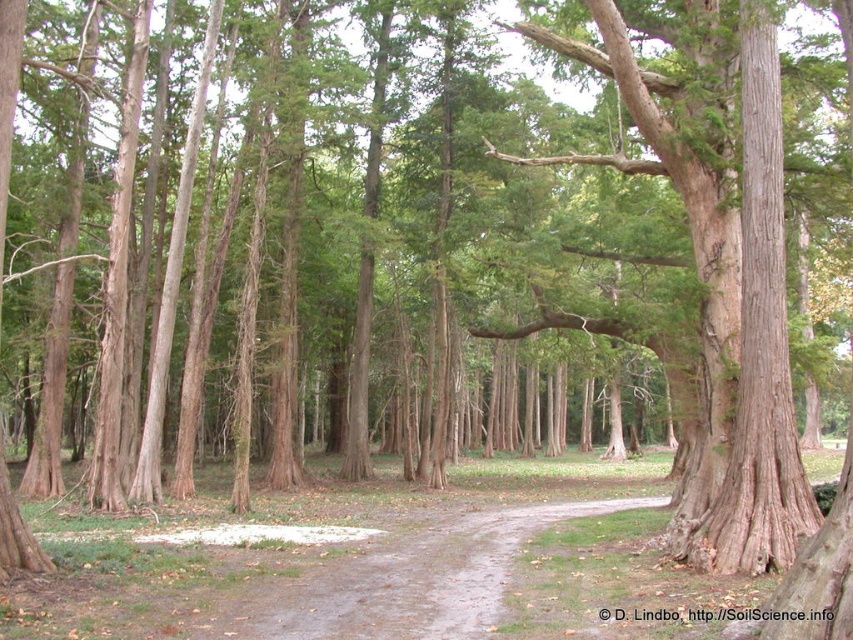
Question: Among these objects, which one is farthest from the camera?

Choices:
 (A) brown dirt path at center
 (B) brown rough textured tree at center

Answer: (B)

Question: Does brown rough textured tree at center have a lesser width compared to brown dirt path at center?

Choices:
 (A) yes
 (B) no

Answer: (B)

Question: Does brown rough textured tree at center come in front of brown dirt path at center?

Choices:
 (A) yes
 (B) no

Answer: (B)

Question: Which object is closer to the camera taking this photo?

Choices:
 (A) brown rough textured tree at center
 (B) brown dirt path at center

Answer: (B)

Question: Is brown rough textured tree at center above brown dirt path at center?

Choices:
 (A) no
 (B) yes

Answer: (B)